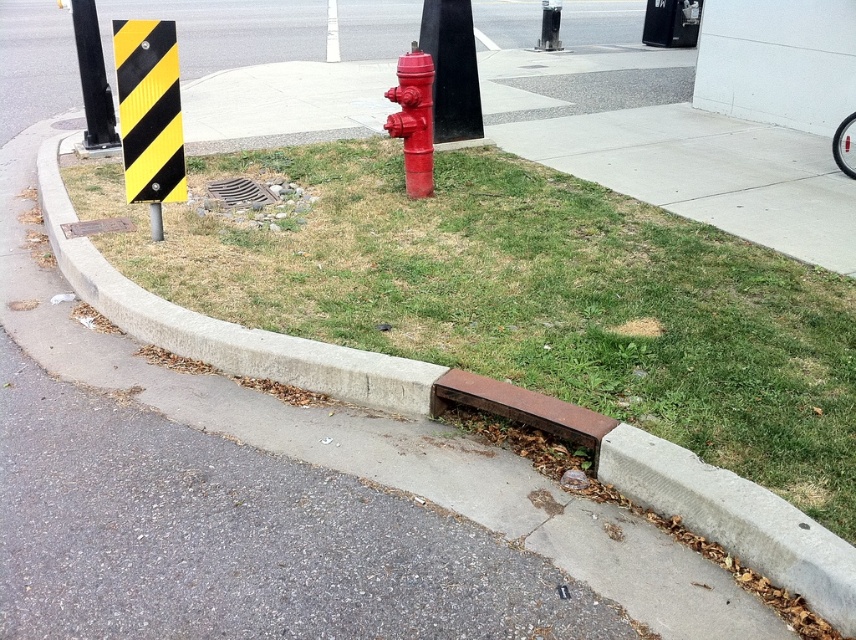
Is green grass at lower center taller than yellow/black striped sign at upper left?

Yes, green grass at lower center is taller than yellow/black striped sign at upper left.

Does green grass at lower center have a lesser width compared to yellow/black striped sign at upper left?

In fact, green grass at lower center might be wider than yellow/black striped sign at upper left.

Where is `green grass at lower center`? green grass at lower center is located at coordinates (539, 300).

Identify the location of green grass at lower center. (539, 300).

This screenshot has height=640, width=856. What are the coordinates of `smooth black pole at center` in the screenshot? It's located at 450,68.

Does black rubber pole at upper left have a lesser width compared to metallic grate at center?

Yes.

Does point (86, 92) lie in front of point (253, 195)?

No, it is behind (253, 195).

Find the location of `black rubber pole at upper left`. black rubber pole at upper left is located at coordinates (92, 77).